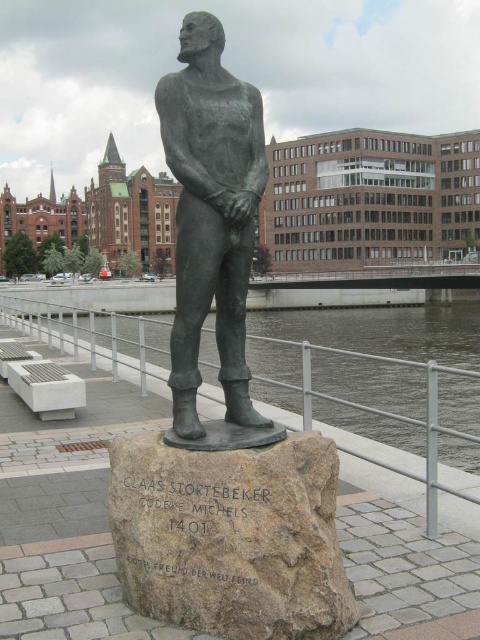
You are a tourist visiting the riverside area and want to take a photo of the brown stone at center and the clear water at statue right. You need to ensure that both objects are visible in your shot. Based on their positions, which object should you focus on first to frame them properly?

The brown stone at center is positioned on the right side of clear water at statue right, so you should focus on the clear water at statue right first to frame both objects properly.

You are a city planner reviewing the layout of the urban riverside setting. The bronze statue of a man stands on a rocky pedestal. Where is the brown stone at center positioned in relation to the statue?

The brown stone at center is located at point coordinates of 0.841 on the x and 0.483 on the y axis, which places it directly at the center of the scene.